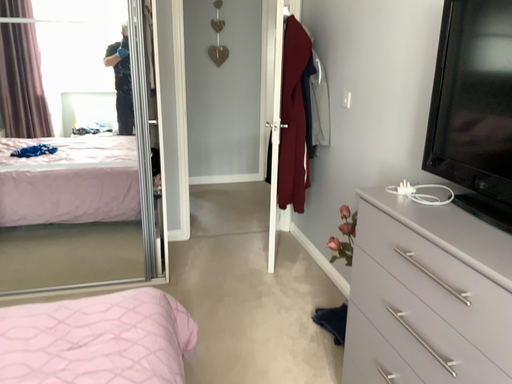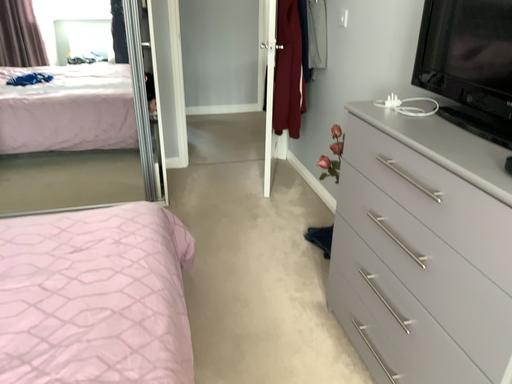
Question: Which way did the camera rotate in the video?

Choices:
 (A) rotated upward
 (B) rotated downward

Answer: (B)